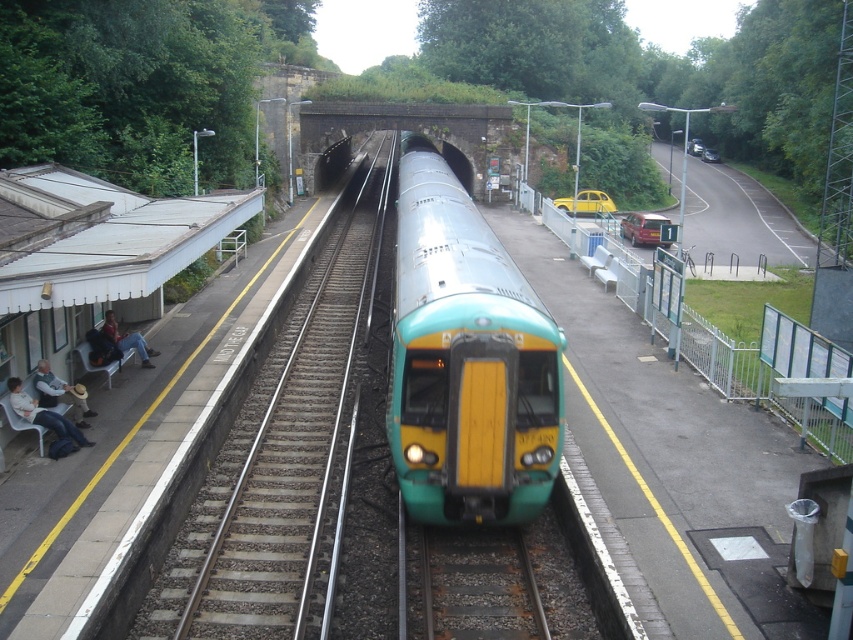
How far apart are rusty metal train track at center and denim jacket at left?

rusty metal train track at center is 9.36 meters from denim jacket at left.

Does point (521, 596) come in front of point (135, 349)?

Yes, it is.

Is point (448, 570) less distant than point (125, 337)?

Yes, it is.

At what (x,y) coordinates should I click in order to perform the action: click on rusty metal train track at center. Please return your answer as a coordinate pair (x, y). This screenshot has height=640, width=853. Looking at the image, I should click on [473, 586].

Is rusty metal train track at center wider than light brown straw hat at left?

Yes.

Based on the photo, can you confirm if rusty metal train track at center is bigger than light brown straw hat at left?

Correct, rusty metal train track at center is larger in size than light brown straw hat at left.

Is point (486, 548) less distant than point (56, 401)?

That is True.

Where is `rusty metal train track at center`? The height and width of the screenshot is (640, 853). rusty metal train track at center is located at coordinates (473, 586).

Does light brown straw hat at left appear on the right side of denim jacket at left?

Correct, you'll find light brown straw hat at left to the right of denim jacket at left.

Does light brown straw hat at left have a greater width compared to denim jacket at left?

No, light brown straw hat at left is not wider than denim jacket at left.

Find the location of `light brown straw hat at left`. light brown straw hat at left is located at coordinates (59, 394).

Locate an element on the screen. light brown straw hat at left is located at coordinates (59, 394).